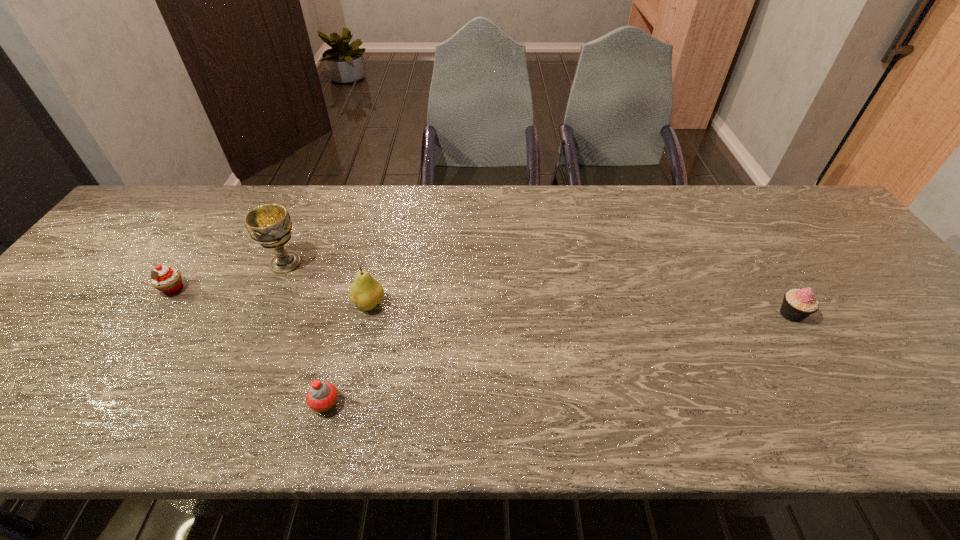
Identify the location of free space between the nearest object and the rightmost cupcake. The width and height of the screenshot is (960, 540). (559, 359).

Find the location of a particular element. The width and height of the screenshot is (960, 540). free spot between the nearest cupcake and the rightmost object is located at coordinates (559, 359).

The image size is (960, 540). I want to click on blank region between the nearest cupcake and the chalice, so click(306, 333).

Image resolution: width=960 pixels, height=540 pixels. Find the location of `free space between the second farthest cupcake and the pear`. free space between the second farthest cupcake and the pear is located at coordinates (581, 309).

Find the location of `free space that is in between the rightmost cupcake and the fourth shortest object`. free space that is in between the rightmost cupcake and the fourth shortest object is located at coordinates (581, 309).

I want to click on empty space between the rightmost cupcake and the leftmost cupcake, so click(x=483, y=302).

The width and height of the screenshot is (960, 540). In order to click on vacant point located between the leftmost object and the nearest cupcake in this screenshot , I will do `click(250, 346)`.

Locate an element on the screen. empty space between the leftmost object and the nearest cupcake is located at coordinates (250, 346).

Find the location of a particular element. Image resolution: width=960 pixels, height=540 pixels. free space between the nearest object and the leftmost object is located at coordinates (250, 346).

Locate an element on the screen. The height and width of the screenshot is (540, 960). free area in between the rightmost object and the farthest cupcake is located at coordinates (483, 302).